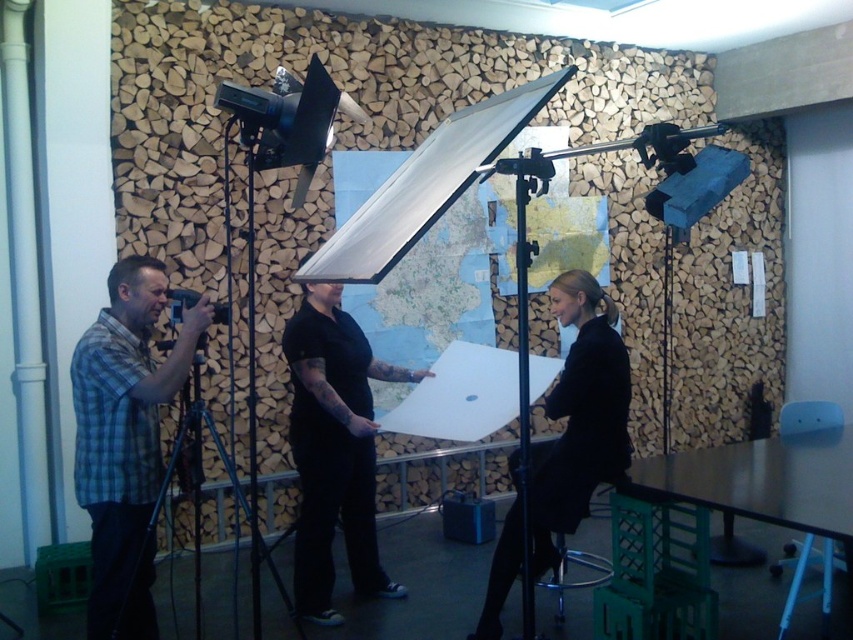
Does plaid shirt at left appear on the right side of black matte dress at center?

No, plaid shirt at left is not to the right of black matte dress at center.

Who is more distant from viewer, (136, 621) or (567, 278)?

The point (567, 278) is more distant.

At what (x,y) coordinates should I click in order to perform the action: click on plaid shirt at left. Please return your answer as a coordinate pair (x, y). The width and height of the screenshot is (853, 640). Looking at the image, I should click on (123, 422).

Which is more to the left, plaid shirt at left or blue metallic tripod at left?

plaid shirt at left

Does point (148, 416) come farther from viewer compared to point (234, 627)?

No, (148, 416) is closer to viewer.

Is point (99, 364) positioned before point (242, 502)?

Yes, it is in front of point (242, 502).

This screenshot has width=853, height=640. Identify the location of plaid shirt at left. (123, 422).

Does black matte shirt at center appear over blue metallic tripod at left?

Correct, black matte shirt at center is located above blue metallic tripod at left.

Can you confirm if black matte shirt at center is positioned below blue metallic tripod at left?

Actually, black matte shirt at center is above blue metallic tripod at left.

Is point (306, 355) positioned behind point (177, 428)?

No, it is not.

This screenshot has height=640, width=853. In order to click on black matte shirt at center in this screenshot , I will do `click(334, 449)`.